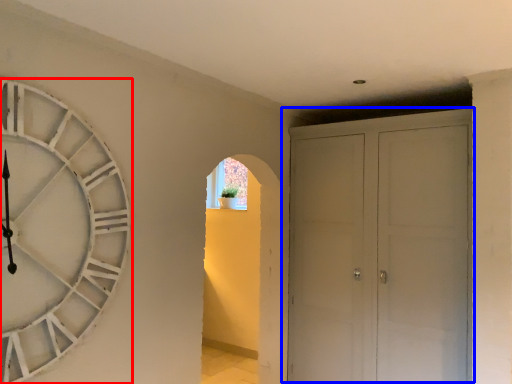
Question: Which point is further to the camera, wall clock (highlighted by a red box) or door (highlighted by a blue box)?

Choices:
 (A) wall clock
 (B) door

Answer: (B)